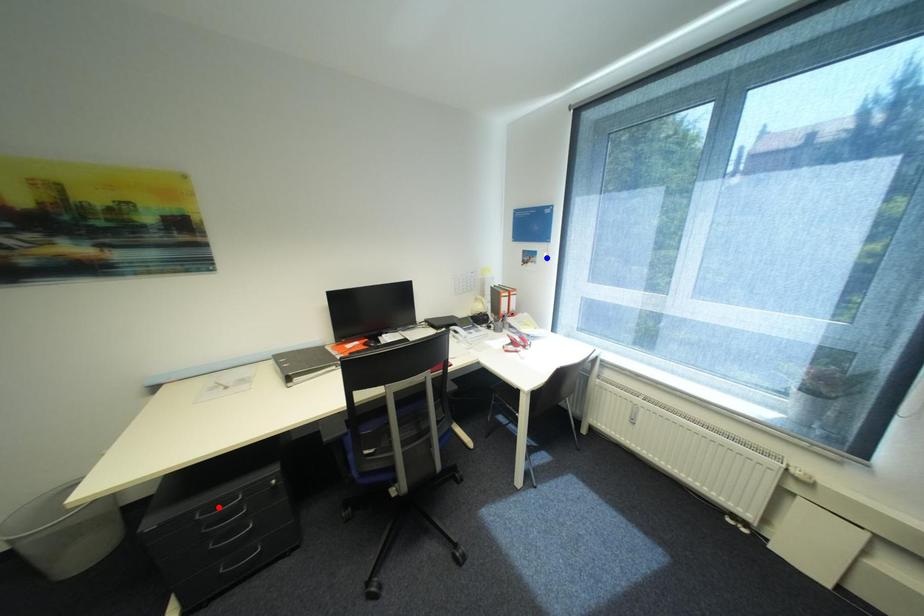
Question: In the image, two points are highlighted. Which point is nearer to the camera? Reply with the corresponding letter.

Choices:
 (A) blue point
 (B) red point

Answer: (B)